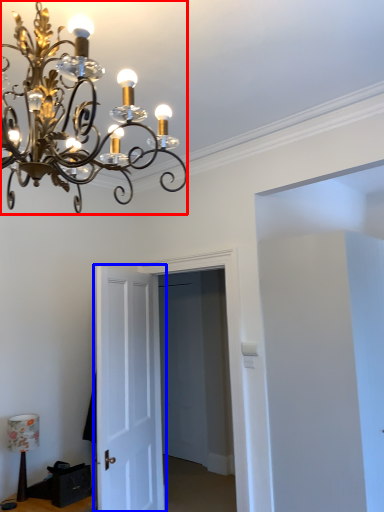
Question: Which of the following is the farthest to the observer, lamp (highlighted by a red box) or door (highlighted by a blue box)?

Choices:
 (A) lamp
 (B) door

Answer: (B)